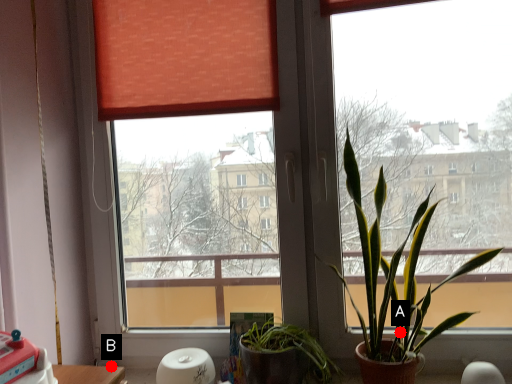
Question: Two points are circled on the image, labeled by A and B beside each circle. Among these points, which one is nearest to the camera?

Choices:
 (A) A is closer
 (B) B is closer

Answer: (A)